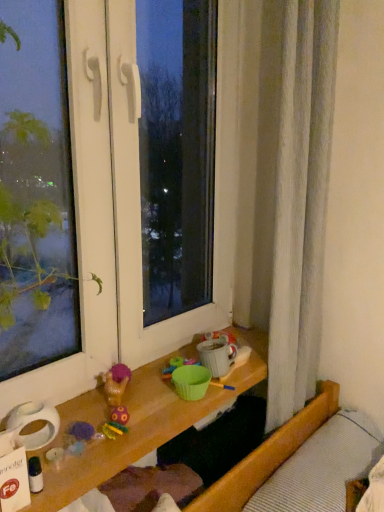
Locate an element on the screen. Image resolution: width=384 pixels, height=512 pixels. white textured bed at lower right is located at coordinates (288, 461).

What do you see at coordinates (288, 461) in the screenshot? I see `white textured bed at lower right` at bounding box center [288, 461].

Describe the element at coordinates (128, 203) in the screenshot. The image size is (384, 512). I see `transparent glass window at center` at that location.

Find the location of a particular element. white textured bed at lower right is located at coordinates (288, 461).

Considering the relative positions of white textured bed at lower right and transparent glass window at center in the image provided, is white textured bed at lower right to the left or to the right of transparent glass window at center?

Clearly, white textured bed at lower right is on the right of transparent glass window at center in the image.

Is white textured bed at lower right far from transparent glass window at center?

white textured bed at lower right is near transparent glass window at center, not far away.

Is white textured bed at lower right shorter than transparent glass window at center?

Yes, white textured bed at lower right is shorter than transparent glass window at center.

Between white textured bed at lower right and transparent glass window at center, which one has larger size?

transparent glass window at center.

What's the angular difference between translucent plastic bottle at lower left, placed as the 1th toy when sorted from front to back, and white textured bed at lower right's facing directions?

The angular difference between translucent plastic bottle at lower left, placed as the 1th toy when sorted from front to back, and white textured bed at lower right is 5.13 degrees.

Is translucent plastic bottle at lower left, marked as the 1th toy in a left-to-right arrangement, outside of white textured bed at lower right?

translucent plastic bottle at lower left, marked as the 1th toy in a left-to-right arrangement, is positioned outside white textured bed at lower right.

Based on their sizes in the image, would you say translucent plastic bottle at lower left, placed as the 1th toy when sorted from front to back, is bigger or smaller than white textured bed at lower right?

Considering their sizes, translucent plastic bottle at lower left, placed as the 1th toy when sorted from front to back, takes up less space than white textured bed at lower right.

Who is more distant, transparent glass window at center or plush purple toy at lower left, positioned as the second toy in left-to-right order?

plush purple toy at lower left, positioned as the second toy in left-to-right order.

Between transparent glass window at center and plush purple toy at lower left, the 1th toy when ordered from top to bottom, which one has less height?

Standing shorter between the two is plush purple toy at lower left, the 1th toy when ordered from top to bottom.

Considering the sizes of transparent glass window at center and plush purple toy at lower left, the 1th toy in the right-to-left sequence, in the image, is transparent glass window at center wider or thinner than plush purple toy at lower left, the 1th toy in the right-to-left sequence,?

Clearly, transparent glass window at center has more width compared to plush purple toy at lower left, the 1th toy in the right-to-left sequence.

Between white textured bed at lower right and plush purple toy at lower left, positioned as the second toy in front-to-back order, which one is positioned in front?

white textured bed at lower right is closer to the camera.

Considering the sizes of objects white textured bed at lower right and plush purple toy at lower left, which is the 1th toy in back-to-front order, in the image provided, who is wider, white textured bed at lower right or plush purple toy at lower left, which is the 1th toy in back-to-front order,?

white textured bed at lower right is wider.

Consider the image. Does white textured bed at lower right turn towards plush purple toy at lower left, which is counted as the second toy, starting from the bottom?

No, white textured bed at lower right is not aimed at plush purple toy at lower left, which is counted as the second toy, starting from the bottom.

The width and height of the screenshot is (384, 512). I want to click on bed beneath the transparent glass window at center (from a real-world perspective), so click(288, 461).

Is transparent glass window at center inside the boundaries of white textured bed at lower right, or outside?

transparent glass window at center is not inside white textured bed at lower right, it's outside.

From the image's perspective, is transparent glass window at center located above white textured bed at lower right?

Correct, transparent glass window at center appears higher than white textured bed at lower right in the image.

Based on the photo, which object is positioned more to the left, transparent glass window at center or white textured bed at lower right?

transparent glass window at center.

Between plush purple toy at lower left, the 1th toy in the right-to-left sequence, and transparent glass window at center, which one appears on the right side from the viewer's perspective?

Positioned to the right is plush purple toy at lower left, the 1th toy in the right-to-left sequence.

Is plush purple toy at lower left, which is counted as the second toy, starting from the bottom, positioned before transparent glass window at center?

No, plush purple toy at lower left, which is counted as the second toy, starting from the bottom, is further to the viewer.

Does plush purple toy at lower left, the 1th toy in the right-to-left sequence, contain transparent glass window at center?

No, transparent glass window at center is not surrounded by plush purple toy at lower left, the 1th toy in the right-to-left sequence.

Is plush purple toy at lower left, the 1th toy in the right-to-left sequence, facing towards transparent glass window at center?

No, plush purple toy at lower left, the 1th toy in the right-to-left sequence, does not turn towards transparent glass window at center.

Does translucent plastic bottle at lower left, which appears as the second toy when viewed from the back, have a greater width compared to transparent glass window at center?

Incorrect, the width of translucent plastic bottle at lower left, which appears as the second toy when viewed from the back, does not surpass that of transparent glass window at center.

Considering the points (34, 462) and (223, 42), which point is behind, point (34, 462) or point (223, 42)?

The point (223, 42) is farther from the camera.

Is translucent plastic bottle at lower left, placed as the 1th toy when sorted from front to back, taller or shorter than transparent glass window at center?

Considering their sizes, translucent plastic bottle at lower left, placed as the 1th toy when sorted from front to back, has less height than transparent glass window at center.

Would you say translucent plastic bottle at lower left, which appears as the second toy when viewed from the back, is to the left or to the right of transparent glass window at center in the picture?

Based on their positions, translucent plastic bottle at lower left, which appears as the second toy when viewed from the back, is located to the left of transparent glass window at center.

I want to click on bed on the right of transparent glass window at center, so click(x=288, y=461).

This screenshot has width=384, height=512. I want to click on the 1st toy above the white textured bed at lower right (from the image's perspective), so click(x=35, y=475).

Which object lies nearer to the anchor point white textured bed at lower right, transparent glass window at center or translucent plastic bottle at lower left, which appears as the second toy when viewed from the back?

transparent glass window at center.

When comparing their distances from translucent plastic bottle at lower left, marked as the 1th toy in a left-to-right arrangement, does white textured bed at lower right or plush purple toy at lower left, the 1th toy in the right-to-left sequence, seem closer?

Based on the image, plush purple toy at lower left, the 1th toy in the right-to-left sequence, appears to be nearer to translucent plastic bottle at lower left, marked as the 1th toy in a left-to-right arrangement.

From the image, which object appears to be nearer to plush purple toy at lower left, which is the 1th toy in back-to-front order, white textured bed at lower right or translucent plastic bottle at lower left, positioned as the 2th toy in top-to-bottom order?

translucent plastic bottle at lower left, positioned as the 2th toy in top-to-bottom order.

Estimate the real-world distances between objects in this image. Which object is closer to plush purple toy at lower left, positioned as the second toy in front-to-back order, translucent plastic bottle at lower left, the first toy when ordered from bottom to top, or transparent glass window at center?

translucent plastic bottle at lower left, the first toy when ordered from bottom to top, is closer to plush purple toy at lower left, positioned as the second toy in front-to-back order.

Based on their spatial positions, is transparent glass window at center or white textured bed at lower right closer to plush purple toy at lower left, positioned as the second toy in front-to-back order?

Among the two, transparent glass window at center is located nearer to plush purple toy at lower left, positioned as the second toy in front-to-back order.

From the image, which object appears to be farther from plush purple toy at lower left, positioned as the second toy in left-to-right order, white textured bed at lower right or transparent glass window at center?

The object further to plush purple toy at lower left, positioned as the second toy in left-to-right order, is white textured bed at lower right.

Estimate the real-world distances between objects in this image. Which object is closer to translucent plastic bottle at lower left, positioned as the 2th toy in top-to-bottom order, white textured bed at lower right or transparent glass window at center?

transparent glass window at center is positioned closer to the anchor translucent plastic bottle at lower left, positioned as the 2th toy in top-to-bottom order.

Based on their spatial positions, is transparent glass window at center or translucent plastic bottle at lower left, positioned as the 2th toy in top-to-bottom order, further from plush purple toy at lower left, the 1th toy when ordered from top to bottom?

transparent glass window at center.

Locate an element on the screen. bed located between transparent glass window at center and plush purple toy at lower left, the 1th toy when ordered from top to bottom, in the depth direction is located at coordinates (288, 461).

Locate an element on the screen. This screenshot has width=384, height=512. toy located between translucent plastic bottle at lower left, the first toy when ordered from bottom to top, and white textured bed at lower right in the left-right direction is located at coordinates [x=116, y=384].

Identify the location of toy between transparent glass window at center and plush purple toy at lower left, the 1th toy in the right-to-left sequence, from front to back. This screenshot has height=512, width=384. pyautogui.click(x=35, y=475).

Where is `window situated between translucent plastic bottle at lower left, the first toy when ordered from bottom to top, and white textured bed at lower right from left to right`? window situated between translucent plastic bottle at lower left, the first toy when ordered from bottom to top, and white textured bed at lower right from left to right is located at coordinates (128, 203).